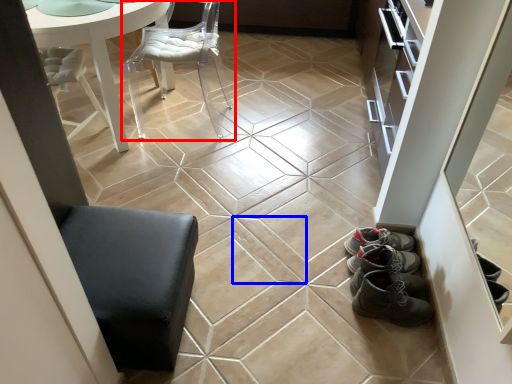
Question: Which point is further to the camera, chair (highlighted by a red box) or ceramic tile (highlighted by a blue box)?

Choices:
 (A) chair
 (B) ceramic tile

Answer: (A)